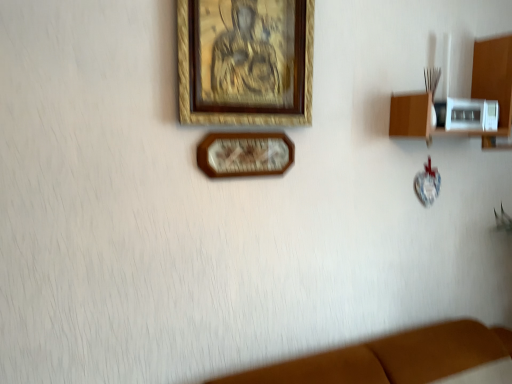
Question: Would you say wooden clock at center, the 1th picture frame positioned from the bottom, is inside or outside wooden shelf at right?

Choices:
 (A) inside
 (B) outside

Answer: (B)

Question: Is wooden clock at center, the 1th picture frame positioned from the bottom, bigger or smaller than wooden shelf at right?

Choices:
 (A) small
 (B) big

Answer: (A)

Question: Considering the real-world distances, which object is farthest from the wooden picture frame at upper center, acting as the first picture frame starting from the top?

Choices:
 (A) wooden shelf at right
 (B) wooden clock at center, the 1th picture frame positioned from the bottom

Answer: (A)

Question: Which object is positioned closest to the wooden shelf at right?

Choices:
 (A) wooden picture frame at upper center, acting as the first picture frame starting from the top
 (B) wooden clock at center, positioned as the 2th picture frame in top-to-bottom order

Answer: (A)